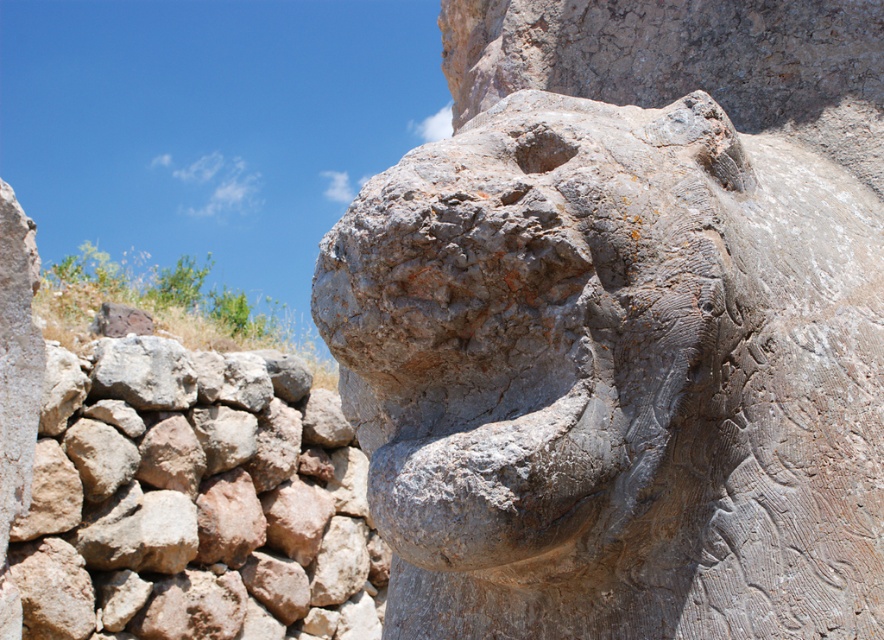
Question: Can you confirm if gray stone lion head at center is wider than gray rough rock at lower left?

Choices:
 (A) yes
 (B) no

Answer: (A)

Question: Estimate the real-world distances between objects in this image. Which object is farther from the gray stone lion head at center?

Choices:
 (A) rustic stone wall at left
 (B) gray rough rock at lower left

Answer: (B)

Question: Does rustic stone wall at left come behind gray rough rock at lower left?

Choices:
 (A) no
 (B) yes

Answer: (A)

Question: Which point is farther from the camera taking this photo?

Choices:
 (A) (273, 573)
 (B) (132, 368)

Answer: (A)

Question: From the image, what is the correct spatial relationship of gray stone lion head at center in relation to rustic stone wall at left?

Choices:
 (A) right
 (B) left

Answer: (A)

Question: Which object appears farthest from the camera in this image?

Choices:
 (A) gray stone lion head at center
 (B) gray rough rock at lower left
 (C) rustic stone wall at left

Answer: (B)